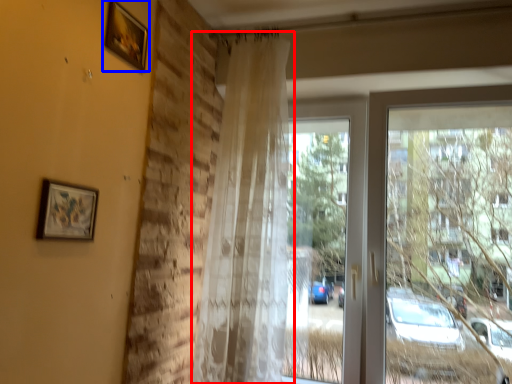
Question: Which point is further to the camera, curtain (highlighted by a red box) or picture frame (highlighted by a blue box)?

Choices:
 (A) curtain
 (B) picture frame

Answer: (A)